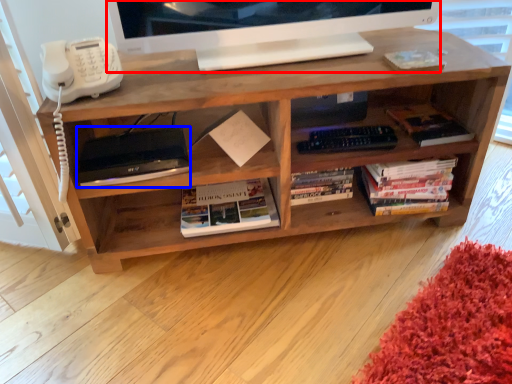
Question: Which object appears closest to the camera in this image, television (highlighted by a red box) or equipment (highlighted by a blue box)?

Choices:
 (A) television
 (B) equipment

Answer: (A)